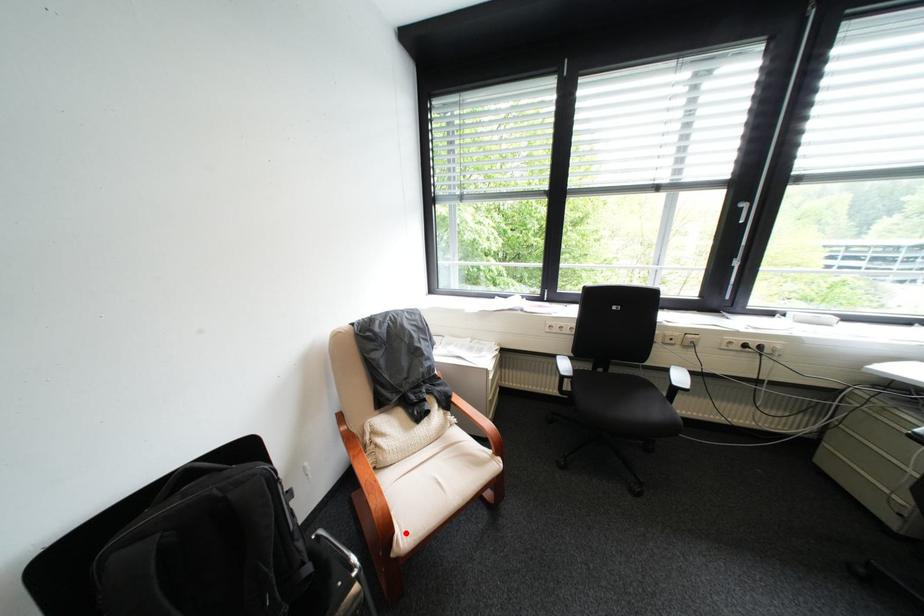
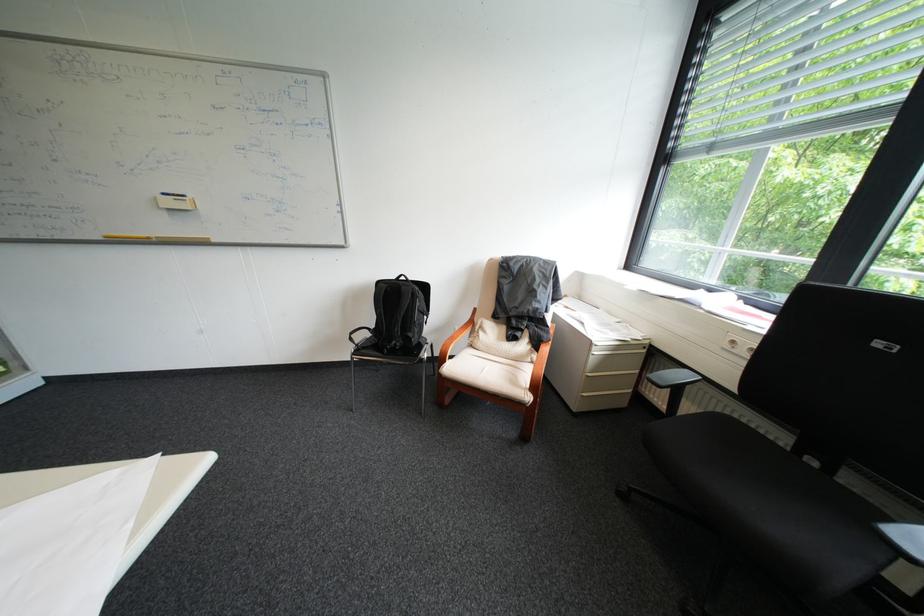
Question: I am providing you with two images of the same scene from different viewpoints. Given a red point in image1, look at the same physical point in image2. Is it:

Choices:
 (A) Closer to the viewpoint
 (B) Farther from the viewpoint

Answer: (A)